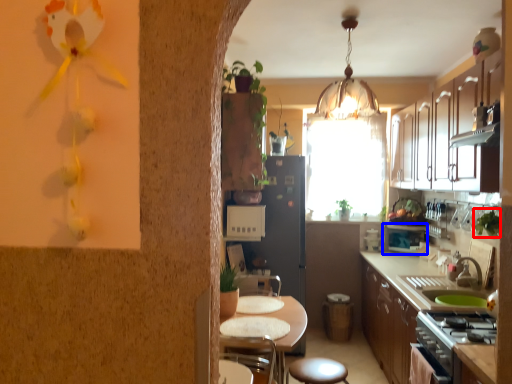
Question: Which point is further to the camera, plant (highlighted by a red box) or appliance (highlighted by a blue box)?

Choices:
 (A) plant
 (B) appliance

Answer: (B)